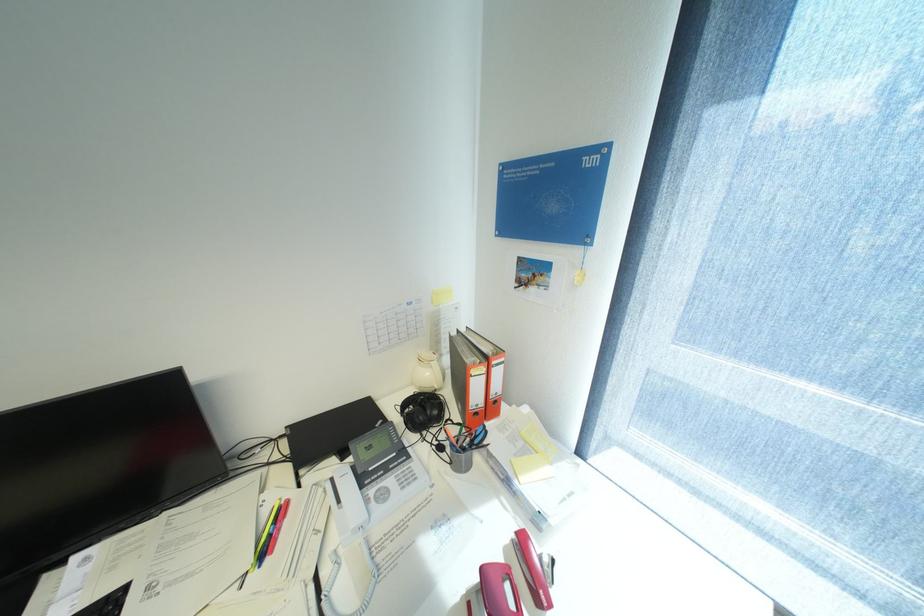
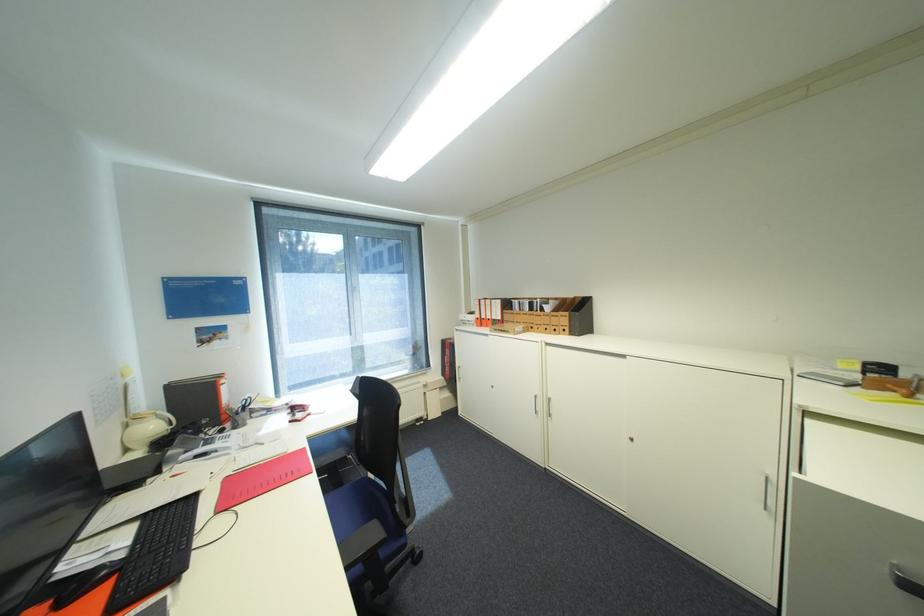
Locate, in the second image, the point that corresponds to point (436, 374) in the first image.

(161, 427)